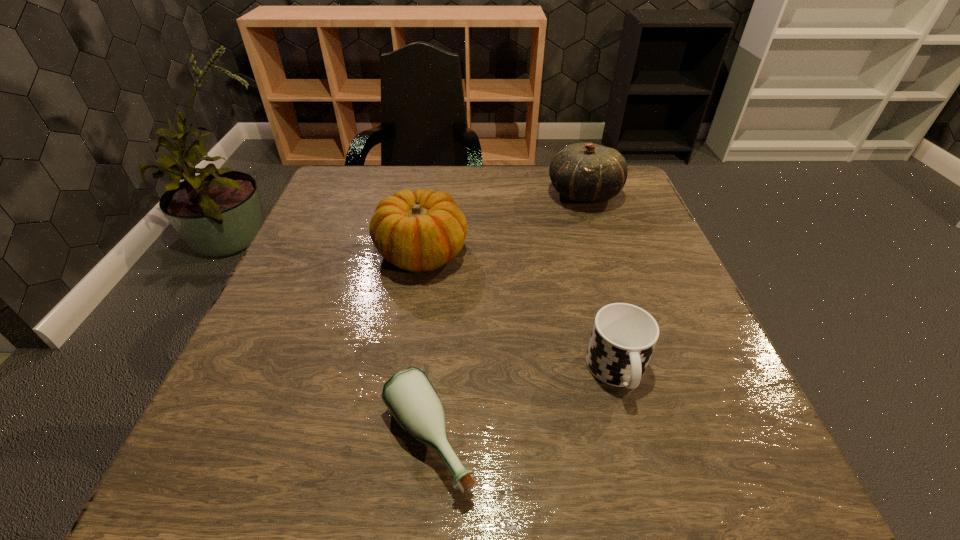
Find the location of `free space between the nearer gourd and the right gourd`. free space between the nearer gourd and the right gourd is located at coordinates (502, 223).

Identify the location of vacant space that's between the farther gourd and the cup. The image size is (960, 540). (600, 283).

Find the location of a particular element. This screenshot has height=540, width=960. free space between the cup and the shortest object is located at coordinates (522, 406).

The image size is (960, 540). What are the coordinates of `free point between the right gourd and the left gourd` in the screenshot? It's located at (502, 223).

What are the coordinates of `free space between the farthest object and the shortest object` in the screenshot? It's located at (505, 317).

In order to click on free space between the nearer gourd and the farther gourd in this screenshot , I will do `click(502, 223)`.

This screenshot has height=540, width=960. I want to click on free spot between the second farthest object and the cup, so click(519, 312).

Locate an element on the screen. This screenshot has height=540, width=960. free space between the second shortest object and the farther gourd is located at coordinates (600, 283).

This screenshot has width=960, height=540. I want to click on unoccupied position between the bottle and the right gourd, so click(505, 317).

The height and width of the screenshot is (540, 960). What are the coordinates of `free space that is in between the left gourd and the farthest object` in the screenshot? It's located at (502, 223).